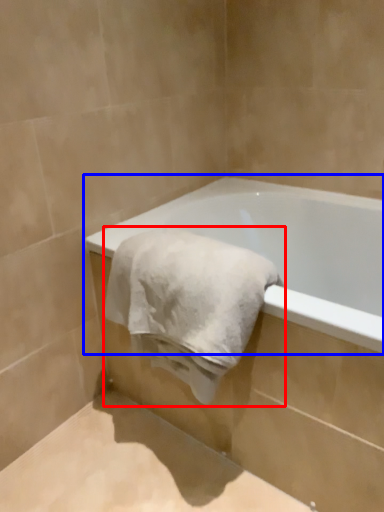
Question: Which object is closer to the camera taking this photo, towel (highlighted by a red box) or bathtub (highlighted by a blue box)?

Choices:
 (A) towel
 (B) bathtub

Answer: (B)